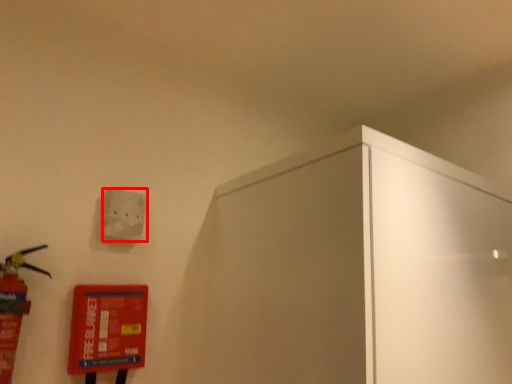
Question: Observing the image, what is the correct spatial positioning of light switch (annotated by the red box) in reference to extinguisher?

Choices:
 (A) left
 (B) right

Answer: (B)